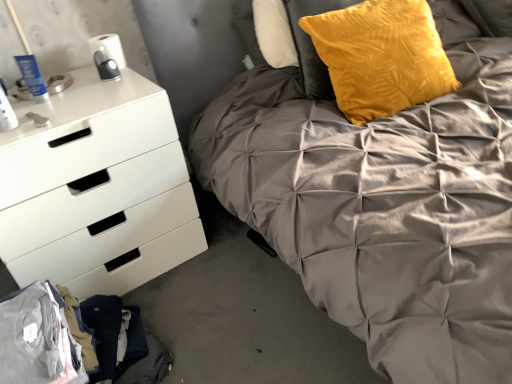
Question: Considering the relative sizes of velvet yellow pillow at upper right and matte gray quilted bed at center in the image provided, is velvet yellow pillow at upper right shorter than matte gray quilted bed at center?

Choices:
 (A) no
 (B) yes

Answer: (B)

Question: Considering the relative sizes of velvet yellow pillow at upper right and matte gray quilted bed at center in the image provided, is velvet yellow pillow at upper right thinner than matte gray quilted bed at center?

Choices:
 (A) yes
 (B) no

Answer: (A)

Question: From the image's perspective, is velvet yellow pillow at upper right under matte gray quilted bed at center?

Choices:
 (A) yes
 (B) no

Answer: (B)

Question: Is velvet yellow pillow at upper right aimed at matte gray quilted bed at center?

Choices:
 (A) no
 (B) yes

Answer: (B)

Question: Does velvet yellow pillow at upper right lie in front of matte gray quilted bed at center?

Choices:
 (A) yes
 (B) no

Answer: (B)

Question: Considering the positions of matte gray quilted bed at center and white matte chest of drawers at left in the image, is matte gray quilted bed at center wider or thinner than white matte chest of drawers at left?

Choices:
 (A) wide
 (B) thin

Answer: (A)

Question: Which is correct: matte gray quilted bed at center is inside white matte chest of drawers at left, or outside of it?

Choices:
 (A) inside
 (B) outside

Answer: (B)

Question: Does point (238, 137) appear closer or farther from the camera than point (1, 190)?

Choices:
 (A) closer
 (B) farther

Answer: (B)

Question: Is matte gray quilted bed at center in front of or behind white matte chest of drawers at left in the image?

Choices:
 (A) front
 (B) behind

Answer: (A)

Question: Is point (366, 92) positioned closer to the camera than point (183, 170)?

Choices:
 (A) farther
 (B) closer

Answer: (B)

Question: From the image's perspective, is velvet yellow pillow at upper right above or below white matte chest of drawers at left?

Choices:
 (A) below
 (B) above

Answer: (B)

Question: Considering the positions of velvet yellow pillow at upper right and white matte chest of drawers at left in the image, is velvet yellow pillow at upper right taller or shorter than white matte chest of drawers at left?

Choices:
 (A) short
 (B) tall

Answer: (A)

Question: Is velvet yellow pillow at upper right spatially inside white matte chest of drawers at left, or outside of it?

Choices:
 (A) outside
 (B) inside

Answer: (A)

Question: Considering the positions of white matte chest of drawers at left and matte gray quilted bed at center in the image, is white matte chest of drawers at left taller or shorter than matte gray quilted bed at center?

Choices:
 (A) short
 (B) tall

Answer: (A)

Question: In terms of width, does white matte chest of drawers at left look wider or thinner when compared to matte gray quilted bed at center?

Choices:
 (A) thin
 (B) wide

Answer: (A)